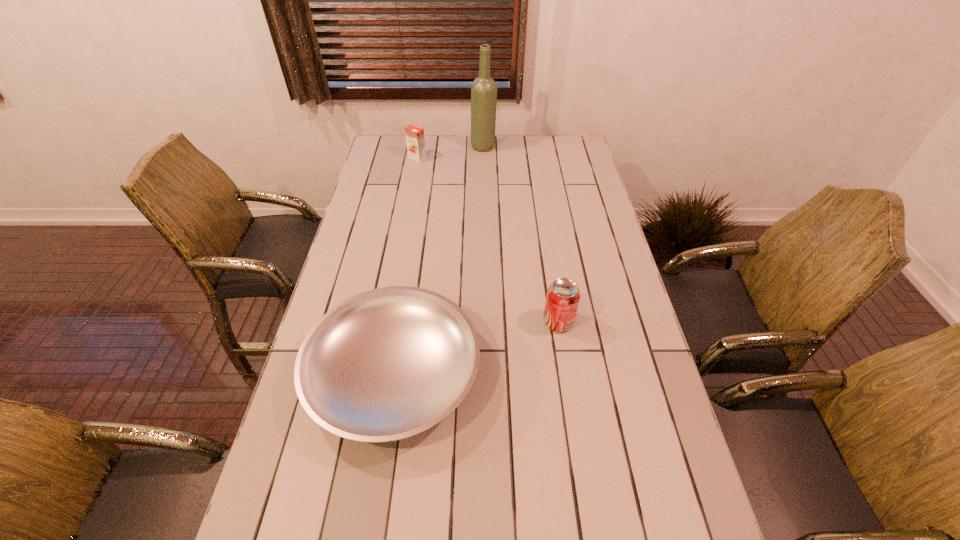
The width and height of the screenshot is (960, 540). Find the location of `wine bottle`. wine bottle is located at coordinates (484, 89).

Identify the location of the rightmost object. (563, 295).

Locate an element on the screen. orange juice is located at coordinates (415, 140).

Locate an element on the screen. bedpan is located at coordinates (386, 364).

At what (x,y) coordinates should I click in order to perform the action: click on free spot located on the right of the wine bottle. Please return your answer as a coordinate pair (x, y). The width and height of the screenshot is (960, 540). Looking at the image, I should click on (569, 147).

Image resolution: width=960 pixels, height=540 pixels. In order to click on blank area located on the left of the rightmost object in this screenshot , I will do `click(500, 322)`.

The width and height of the screenshot is (960, 540). I want to click on vacant region located on the right of the orange juice, so pos(479,158).

This screenshot has height=540, width=960. I want to click on free space located 0.400m on the right of the bedpan, so click(x=636, y=373).

What are the coordinates of `wine bottle positioned at the far edge` in the screenshot? It's located at (484, 89).

At what (x,y) coordinates should I click in order to perform the action: click on orange juice that is at the far edge. Please return your answer as a coordinate pair (x, y). The height and width of the screenshot is (540, 960). Looking at the image, I should click on (415, 140).